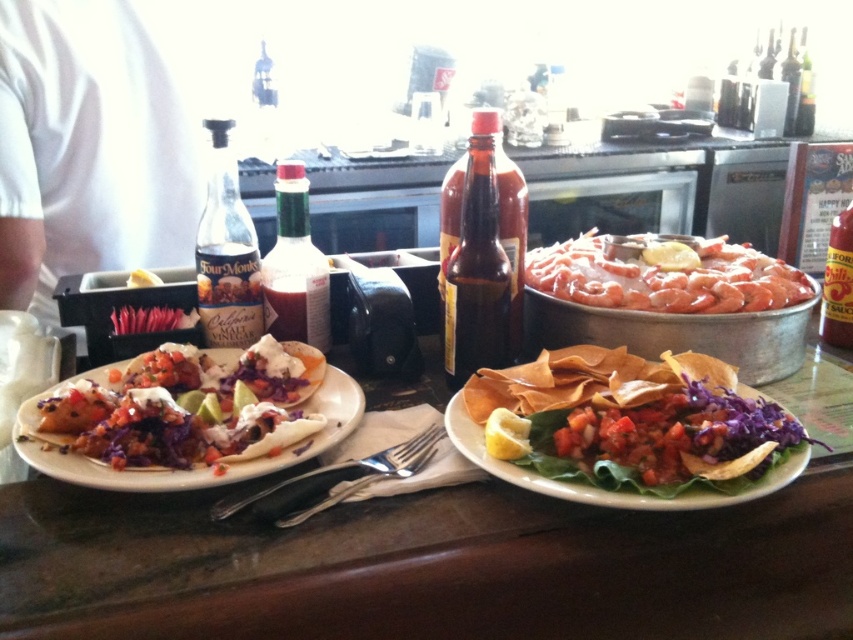
You are a diner who wants to grab the shiny silver taco at center and the red glass hot sauce at right. Which object is wider?

The shiny silver taco at center is wider than the red glass hot sauce at right.

You are a diner who wants to grab the shiny silver taco at center and the red glass hot sauce at right. Which one is bigger in size?

The shiny silver taco at center is larger in size compared to the red glass hot sauce at right.